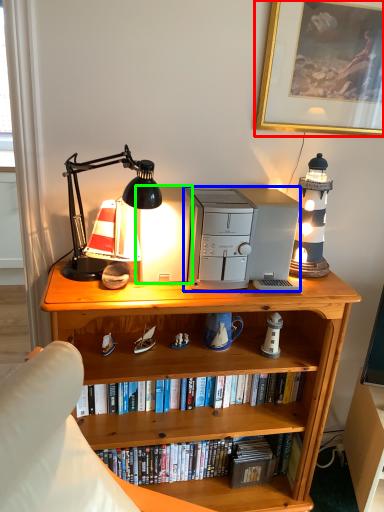
Question: Estimate the real-world distances between objects in this image. Which object is farther from picture frame (highlighted by a red box), appliance (highlighted by a blue box) or appliance (highlighted by a green box)?

Choices:
 (A) appliance
 (B) appliance

Answer: (B)